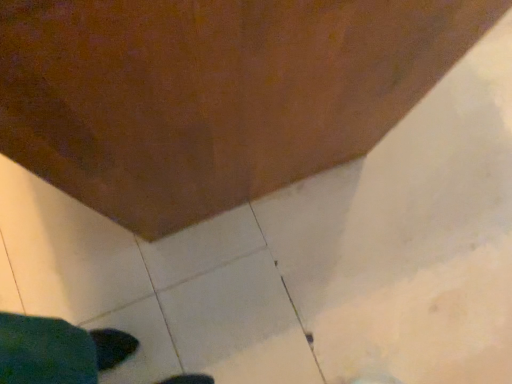
In order to click on matte brown cardboard at upper left in this screenshot , I will do `click(213, 93)`.

The image size is (512, 384). What do you see at coordinates (213, 93) in the screenshot?
I see `matte brown cardboard at upper left` at bounding box center [213, 93].

Locate an element on the screen. matte brown cardboard at upper left is located at coordinates point(213,93).